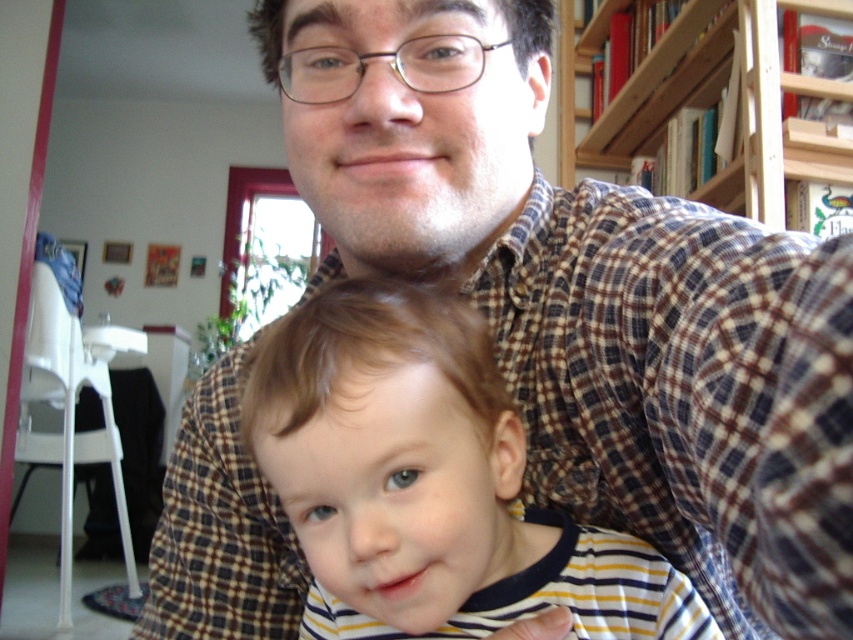
Does striped cotton shirt at center have a greater width compared to wooden bookshelf at upper right?

No.

How far apart are striped cotton shirt at center and wooden bookshelf at upper right?

The distance of striped cotton shirt at center from wooden bookshelf at upper right is 1.38 meters.

Between point (252, 378) and point (583, 33), which one is positioned behind?

Positioned behind is point (583, 33).

The height and width of the screenshot is (640, 853). I want to click on striped cotton shirt at center, so click(428, 481).